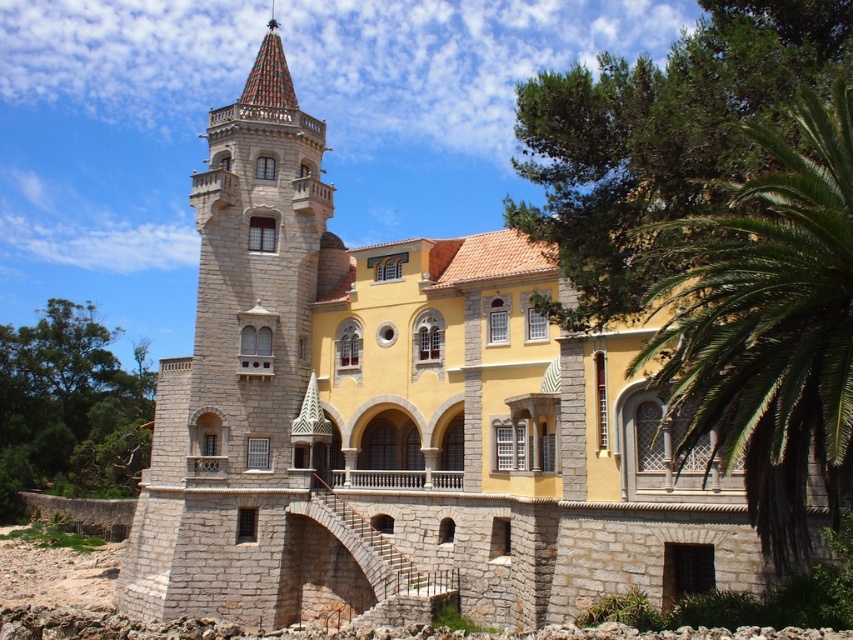
Question: Does stone tower at center have a lesser width compared to green leafy palm at right?

Choices:
 (A) no
 (B) yes

Answer: (A)

Question: Can you confirm if stone tower at center is thinner than green leafy palm at right?

Choices:
 (A) no
 (B) yes

Answer: (A)

Question: Does stone tower at center lie behind green leafy palm at right?

Choices:
 (A) yes
 (B) no

Answer: (A)

Question: Which point is farther from the camera taking this photo?

Choices:
 (A) (258, 492)
 (B) (846, 493)

Answer: (A)

Question: Which object appears closest to the camera in this image?

Choices:
 (A) stone tower at center
 (B) green leafy palm at right

Answer: (B)